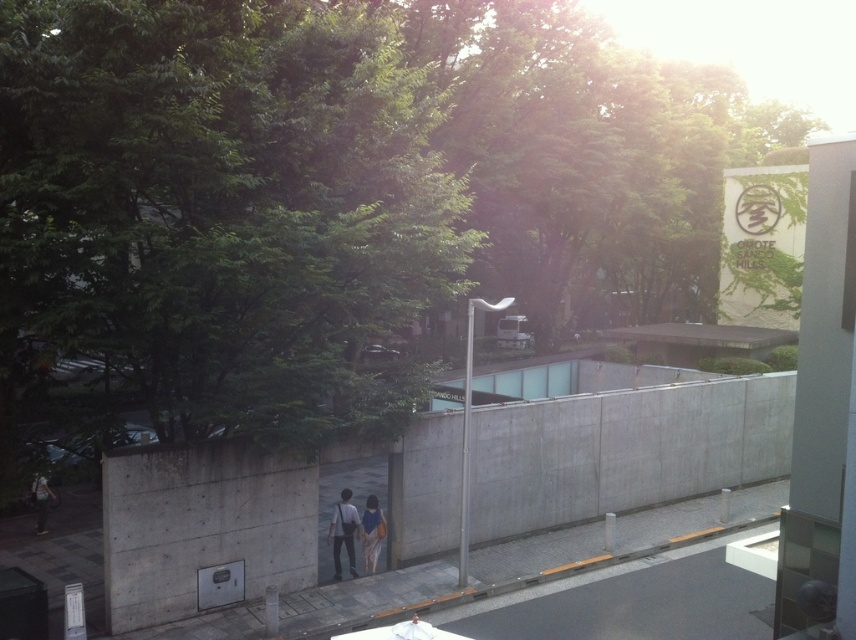
You are a photographer trying to capture the matte blue dress at center and the blue fabric bag at center in a single shot. Since both items are at the center, which one will appear larger in the photo?

The matte blue dress at center will appear larger in the photo because it is closer to the viewer than the blue fabric bag at center.

You are a delivery person trying to locate the blue fabric bag at center and the matte black jacket at lower left in the urban scene. According to the image, which object is closer to you?

The blue fabric bag at center is closer to you because it is in front of the matte black jacket at lower left.